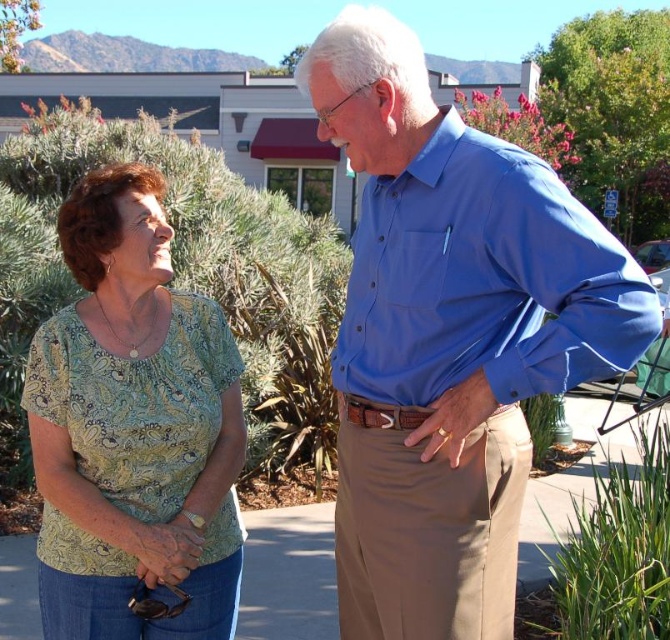
I want to click on blue cotton shirt at center, so click(x=450, y=337).

Which of these two, blue cotton shirt at center or green paisley blouse at left, stands taller?

blue cotton shirt at center

Who is more forward, (383, 355) or (198, 369)?

Positioned in front is point (383, 355).

Locate an element on the screen. The width and height of the screenshot is (670, 640). blue cotton shirt at center is located at coordinates (450, 337).